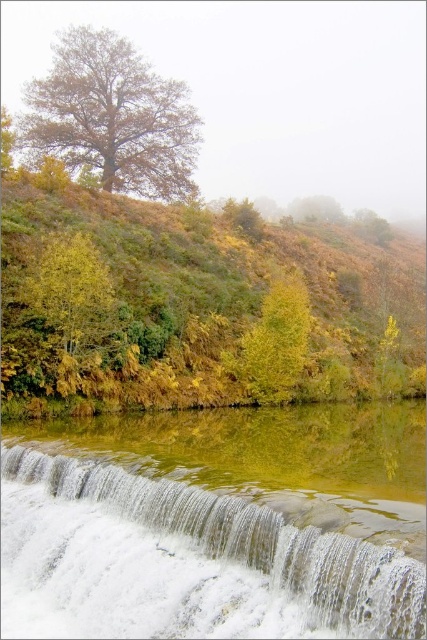
You are an artist sketching the landscape and want to ensure proper proportions. Which object, the white frothy water at lower center or the brown matte tree at upper left, is shorter in height?

The white frothy water at lower center is shorter in height than the brown matte tree at upper left.

You are standing at the edge of the waterfall and want to take a photo of both the green leafy hillside at lower left and the brown matte tree at upper left. Which object will appear larger in your photo?

The green leafy hillside at lower left will appear larger in the photo because it is closer to the viewer than the brown matte tree at upper left.